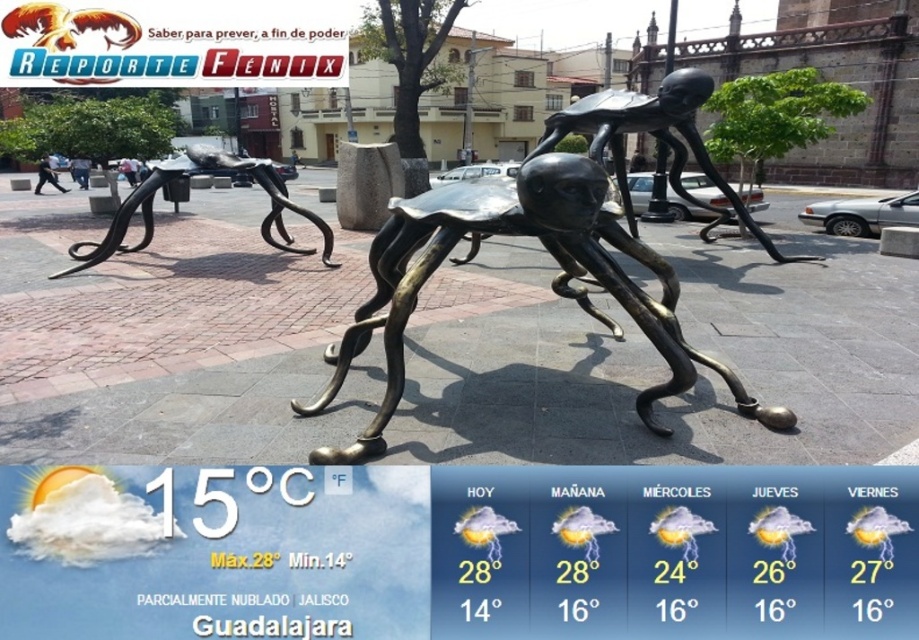
You are an art student analyzing the sculptures in the public square. You notice two central sculptures labeled as the metallic spider at center and bronze sculpture at center. Which one has a greater height?

The bronze sculpture at center is taller than the metallic spider at center, so the bronze sculpture at center has a greater height.

You are a maintenance worker in the square. You need to move the metallic spider at center and bronze sculpture at center closer to each other so that they are only 3 meters apart. Is this possible given their current spacing?

The current distance between the metallic spider at center and bronze sculpture at center is 4.26 meters. To reduce this to 3 meters, you would need to move them closer by 1.26 meters. This adjustment is feasible as long as there is sufficient space available in the square to maneuver them into the desired positions without obstruction.

Based on the photo, you are standing in the public square and see the metallic spider at center and the bronze sculpture at center. Which one is positioned to the right side of the square?

The metallic spider at center is positioned to the right of the bronze sculpture at center.